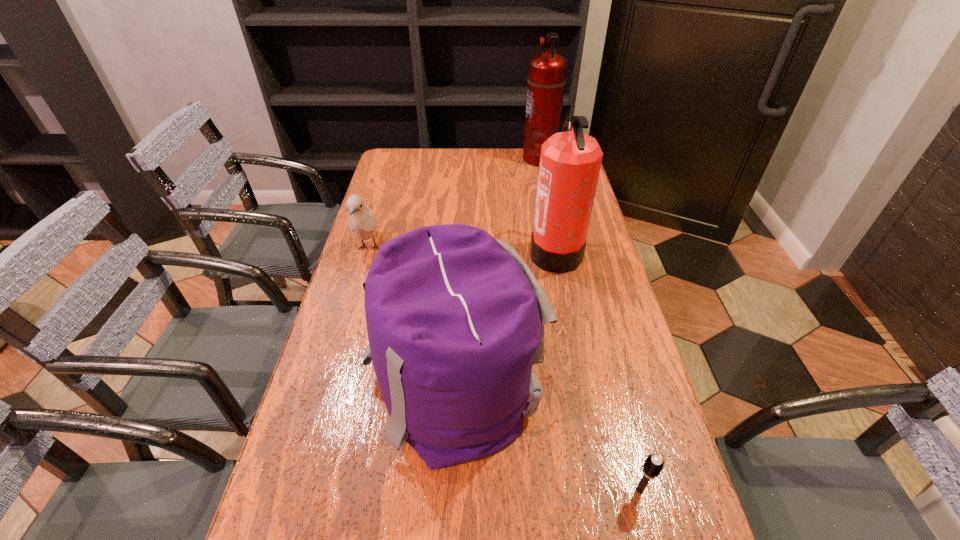
You are a GUI agent. You are given a task and a screenshot of the screen. Output one action in this format:
    pyautogui.click(x=<x>, y=<y>)
    Task: Click on the hairbrush that is positioned at the right edge
    This screenshot has width=960, height=540.
    Given the screenshot: What is the action you would take?
    pyautogui.click(x=653, y=465)

The width and height of the screenshot is (960, 540). In order to click on object located at the far right corner in this screenshot , I will do `click(546, 80)`.

The image size is (960, 540). I want to click on free space at the far edge of the desktop, so click(x=427, y=151).

Where is `vacant space at the left edge of the desktop`? The width and height of the screenshot is (960, 540). vacant space at the left edge of the desktop is located at coordinates (384, 202).

The image size is (960, 540). I want to click on free space at the right edge of the desktop, so click(634, 497).

At what (x,y) coordinates should I click in order to perform the action: click on vacant region between the farther fire extinguisher and the fourth tallest object. Please return your answer as a coordinate pair (x, y). Looking at the image, I should click on click(x=454, y=204).

This screenshot has width=960, height=540. What are the coordinates of `empty location between the leftmost object and the farther fire extinguisher` in the screenshot? It's located at (454, 204).

Where is `unoccupied area between the shortest object and the second object from left to right`? unoccupied area between the shortest object and the second object from left to right is located at coordinates (546, 437).

The width and height of the screenshot is (960, 540). I want to click on free space between the nearest object and the farther fire extinguisher, so click(589, 324).

Where is `free space between the hairbrush and the nearer fire extinguisher`? Image resolution: width=960 pixels, height=540 pixels. free space between the hairbrush and the nearer fire extinguisher is located at coordinates (597, 371).